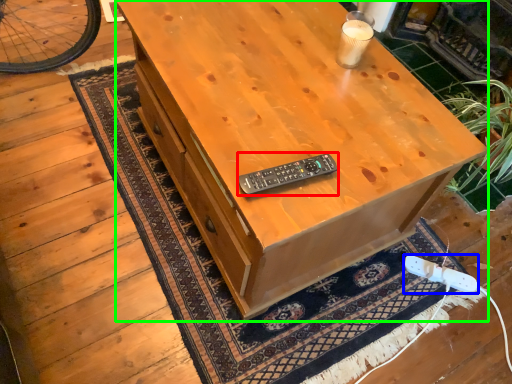
Question: Considering the real-world distances, which object is farthest from control (highlighted by a red box)? game controller (highlighted by a blue box) or desk (highlighted by a green box)?

Choices:
 (A) game controller
 (B) desk

Answer: (A)